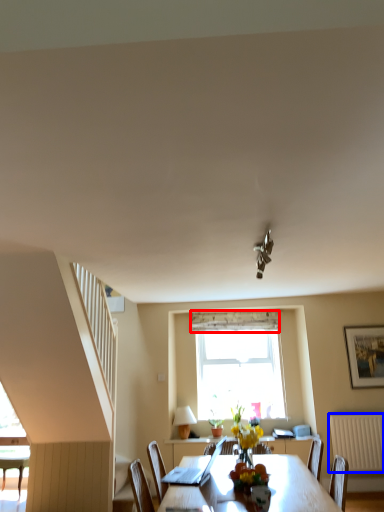
Question: Which object appears closest to the camera in this image, curtain (highlighted by a red box) or radiator (highlighted by a blue box)?

Choices:
 (A) curtain
 (B) radiator

Answer: (B)